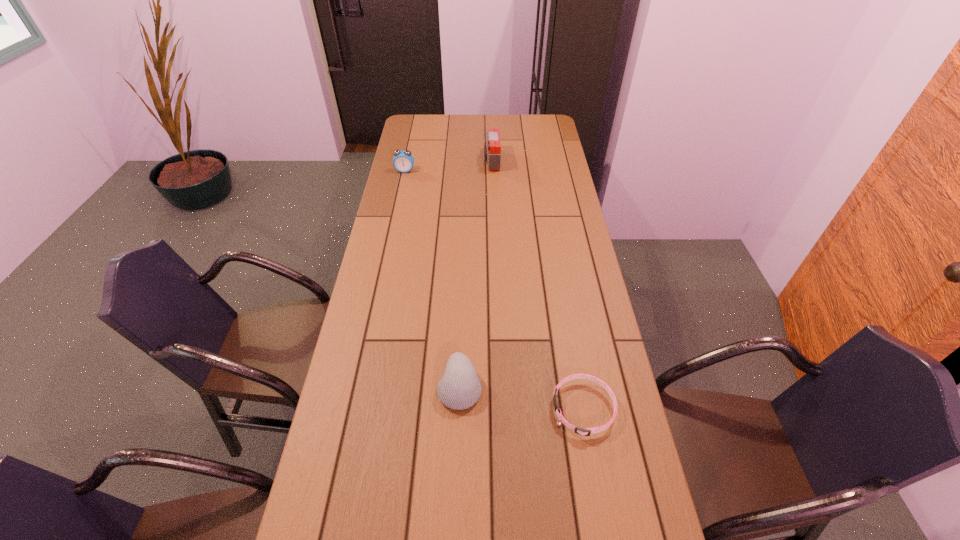
I want to click on free space between the camera and the alarm clock, so click(448, 166).

Image resolution: width=960 pixels, height=540 pixels. Identify the location of unoccupied position between the shortest object and the second object from right to left. (538, 285).

Find the location of `vacant point located between the tallest object and the beanie`. vacant point located between the tallest object and the beanie is located at coordinates (475, 274).

The width and height of the screenshot is (960, 540). I want to click on free space between the third object from left to right and the shortest object, so click(x=538, y=285).

Locate an element on the screen. Image resolution: width=960 pixels, height=540 pixels. free spot between the shortest object and the tallest object is located at coordinates (538, 285).

Identify the location of free space between the tallest object and the beanie. (475, 274).

At what (x,y) coordinates should I click in order to perform the action: click on free area in between the alarm clock and the beanie. Please return your answer as a coordinate pair (x, y). This screenshot has width=960, height=540. Looking at the image, I should click on pyautogui.click(x=432, y=279).

What are the coordinates of `unoccupied area between the rightmost object and the third object from right to left` in the screenshot? It's located at (521, 397).

Find the location of `free area in between the shortest object and the beanie`. free area in between the shortest object and the beanie is located at coordinates [x=521, y=397].

Where is `the closest object relative to the camera`? This screenshot has width=960, height=540. the closest object relative to the camera is located at coordinates (403, 161).